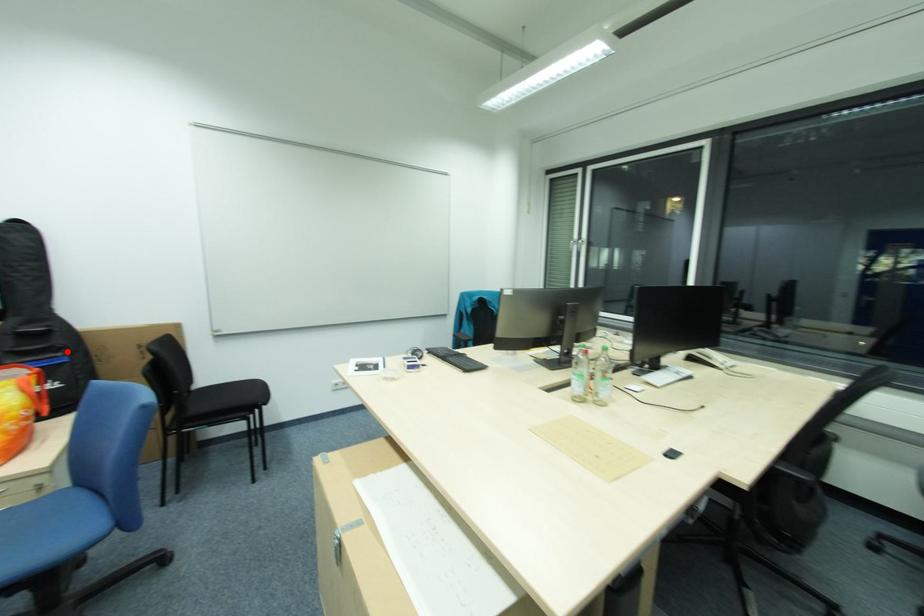
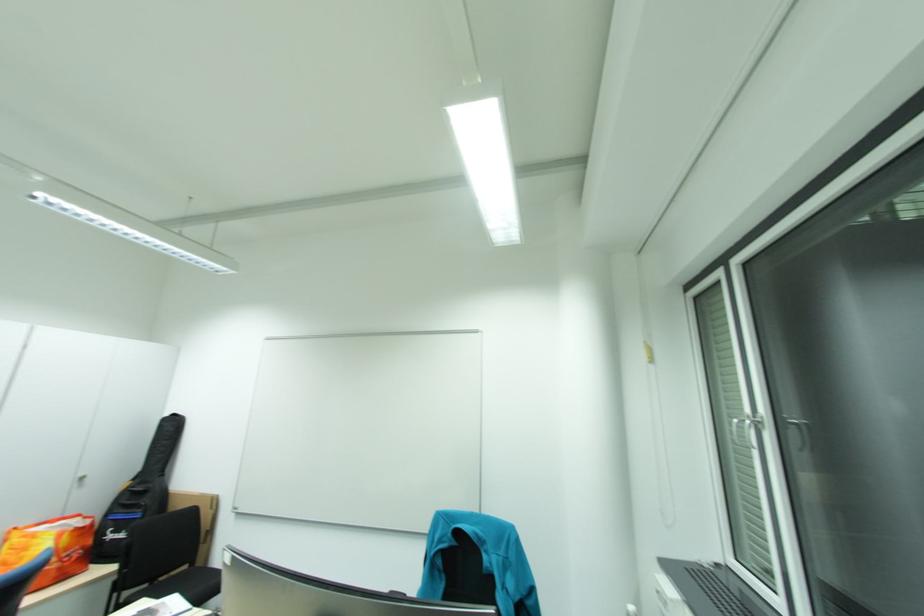
Question: I am providing you with two images of the same scene from different viewpoints. A red point is shown in image1. For the corresponding object point in image2, is it positioned nearer or farther from the camera?

Choices:
 (A) Nearer
 (B) Farther

Answer: (A)